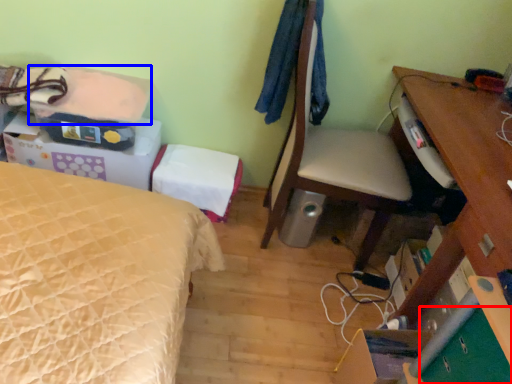
Question: Which point is further to the camera, drawer (highlighted by a red box) or sheet (highlighted by a blue box)?

Choices:
 (A) drawer
 (B) sheet

Answer: (B)